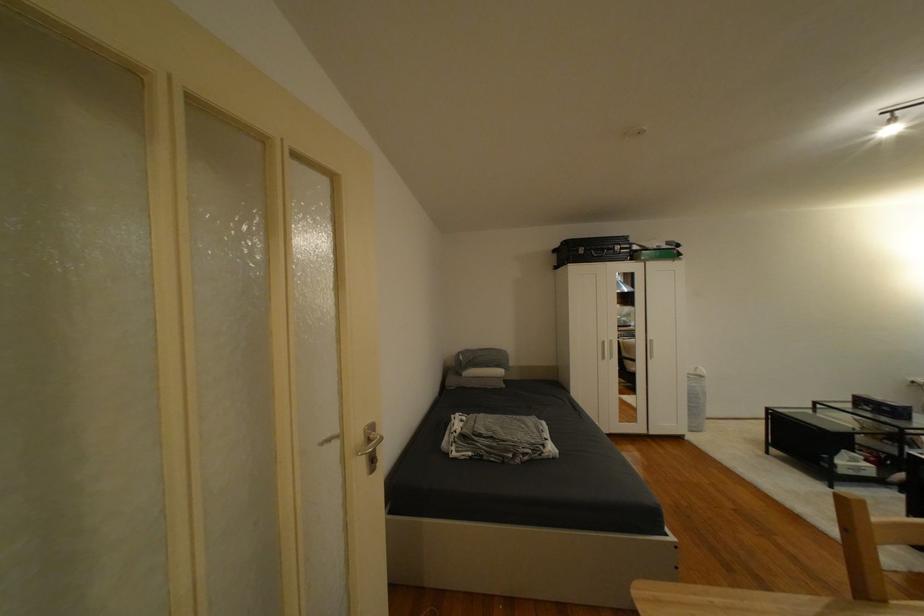
Where is `black suitcase`? black suitcase is located at coordinates (591, 249).